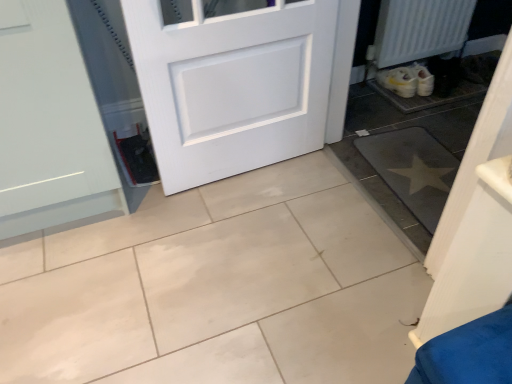
Where is `white textured radiator at lower right`? Image resolution: width=512 pixels, height=384 pixels. white textured radiator at lower right is located at coordinates (420, 29).

Is gray matte mat at lower right, marked as the 2th ceramic tile in a left-to-right arrangement, facing away from white textured radiator at lower right?

No.

Considering the positions of objects gray matte mat at lower right, marked as the 2th ceramic tile in a left-to-right arrangement, and white textured radiator at lower right in the image provided, who is behind, gray matte mat at lower right, marked as the 2th ceramic tile in a left-to-right arrangement, or white textured radiator at lower right?

white textured radiator at lower right is behind.

Does point (434, 138) appear closer or farther from the camera than point (418, 20)?

Point (434, 138) appears to be closer to the viewer than point (418, 20).

From the image's perspective, which one is positioned higher, gray matte mat at lower right, marked as the 2th ceramic tile in a left-to-right arrangement, or white textured radiator at lower right?

white textured radiator at lower right.

Considering the relative sizes of white glossy tile at center, acting as the first ceramic tile starting from the left, and white textured radiator at lower right in the image provided, is white glossy tile at center, acting as the first ceramic tile starting from the left, shorter than white textured radiator at lower right?

Indeed, white glossy tile at center, acting as the first ceramic tile starting from the left, has a lesser height compared to white textured radiator at lower right.

Is white glossy tile at center, which is the second ceramic tile from right to left, beside white textured radiator at lower right?

No, white glossy tile at center, which is the second ceramic tile from right to left, is not next to white textured radiator at lower right.

Between point (287, 179) and point (438, 29), which one is positioned behind?

The point (438, 29) is farther.

From a real-world perspective, does white glossy tile at center, which is the second ceramic tile from right to left, sit lower than white textured radiator at lower right?

Yes, from a real-world perspective, white glossy tile at center, which is the second ceramic tile from right to left, is beneath white textured radiator at lower right.

Considering the relative sizes of white textured radiator at lower right and gray matte mat at lower right, marked as the 2th ceramic tile in a left-to-right arrangement, in the image provided, is white textured radiator at lower right smaller than gray matte mat at lower right, marked as the 2th ceramic tile in a left-to-right arrangement,?

Actually, white textured radiator at lower right might be larger than gray matte mat at lower right, marked as the 2th ceramic tile in a left-to-right arrangement.

Is white textured radiator at lower right turned away from gray matte mat at lower right, marked as the 1th ceramic tile in a right-to-left arrangement?

white textured radiator at lower right is not turned away from gray matte mat at lower right, marked as the 1th ceramic tile in a right-to-left arrangement.

From the image's perspective, is white textured radiator at lower right beneath gray matte mat at lower right, marked as the 2th ceramic tile in a left-to-right arrangement?

Incorrect, from the image's perspective, white textured radiator at lower right is higher than gray matte mat at lower right, marked as the 2th ceramic tile in a left-to-right arrangement.

Considering the relative sizes of white glossy tile at center, acting as the first ceramic tile starting from the left, and gray matte mat at lower right, marked as the 1th ceramic tile in a right-to-left arrangement, in the image provided, is white glossy tile at center, acting as the first ceramic tile starting from the left, thinner than gray matte mat at lower right, marked as the 1th ceramic tile in a right-to-left arrangement,?

No, white glossy tile at center, acting as the first ceramic tile starting from the left, is not thinner than gray matte mat at lower right, marked as the 1th ceramic tile in a right-to-left arrangement.

Is white glossy tile at center, which is the second ceramic tile from right to left, looking in the opposite direction of gray matte mat at lower right, marked as the 1th ceramic tile in a right-to-left arrangement?

No, white glossy tile at center, which is the second ceramic tile from right to left, is not facing away from gray matte mat at lower right, marked as the 1th ceramic tile in a right-to-left arrangement.

From the image's perspective, is white glossy tile at center, which is the second ceramic tile from right to left, above or below gray matte mat at lower right, marked as the 1th ceramic tile in a right-to-left arrangement?

white glossy tile at center, which is the second ceramic tile from right to left, is situated lower than gray matte mat at lower right, marked as the 1th ceramic tile in a right-to-left arrangement, in the image.

Which object is wider, gray matte mat at lower right, marked as the 1th ceramic tile in a right-to-left arrangement, or white matte door at center?

Wider between the two is gray matte mat at lower right, marked as the 1th ceramic tile in a right-to-left arrangement.

Is gray matte mat at lower right, marked as the 1th ceramic tile in a right-to-left arrangement, positioned beyond the bounds of white matte door at center?

Absolutely, gray matte mat at lower right, marked as the 1th ceramic tile in a right-to-left arrangement, is external to white matte door at center.

Can you see gray matte mat at lower right, marked as the 1th ceramic tile in a right-to-left arrangement, touching white matte door at center?

gray matte mat at lower right, marked as the 1th ceramic tile in a right-to-left arrangement, and white matte door at center are clearly separated.

From the image's perspective, which one is positioned higher, white glossy tile at center, acting as the first ceramic tile starting from the left, or white matte door at center?

white matte door at center is shown above in the image.

From a real-world perspective, is white glossy tile at center, which is the second ceramic tile from right to left, above or below white matte door at center?

In terms of real-world spatial position, white glossy tile at center, which is the second ceramic tile from right to left, is below white matte door at center.

Is white glossy tile at center, which is the second ceramic tile from right to left, at the left side of white matte door at center?

Correct, you'll find white glossy tile at center, which is the second ceramic tile from right to left, to the left of white matte door at center.

In the scene shown: Does white glossy tile at center, which is the second ceramic tile from right to left, turn towards white matte door at center?

No.

Which object is more forward, white textured radiator at lower right or white glossy tile at center, acting as the first ceramic tile starting from the left?

Positioned in front is white glossy tile at center, acting as the first ceramic tile starting from the left.

Does white textured radiator at lower right appear on the left side of white glossy tile at center, acting as the first ceramic tile starting from the left?

In fact, white textured radiator at lower right is to the right of white glossy tile at center, acting as the first ceramic tile starting from the left.

From a real-world perspective, who is located lower, white textured radiator at lower right or white glossy tile at center, acting as the first ceramic tile starting from the left?

white glossy tile at center, acting as the first ceramic tile starting from the left, is physically lower.

Based on the photo, what's the angular difference between white textured radiator at lower right and white glossy tile at center, acting as the first ceramic tile starting from the left,'s facing directions?

They differ by 179 degrees in their facing directions.

Find the location of `radiator that appears on the right of gray matte mat at lower right, marked as the 2th ceramic tile in a left-to-right arrangement`. radiator that appears on the right of gray matte mat at lower right, marked as the 2th ceramic tile in a left-to-right arrangement is located at coordinates (420, 29).

From a real-world perspective, starting from the white textured radiator at lower right, which ceramic tile is the 2nd one below it? Please provide its 2D coordinates.

[(217, 289)]

Estimate the real-world distances between objects in this image. Which object is further from white glossy tile at center, which is the second ceramic tile from right to left, gray matte mat at lower right, marked as the 1th ceramic tile in a right-to-left arrangement, or white matte door at center?

The object further to white glossy tile at center, which is the second ceramic tile from right to left, is gray matte mat at lower right, marked as the 1th ceramic tile in a right-to-left arrangement.

Based on their spatial positions, is white matte door at center or white textured radiator at lower right closer to gray matte mat at lower right, marked as the 2th ceramic tile in a left-to-right arrangement?

white matte door at center is positioned closer to the anchor gray matte mat at lower right, marked as the 2th ceramic tile in a left-to-right arrangement.

When comparing their distances from white glossy tile at center, acting as the first ceramic tile starting from the left, does white matte door at center or gray matte mat at lower right, marked as the 2th ceramic tile in a left-to-right arrangement, seem further?

gray matte mat at lower right, marked as the 2th ceramic tile in a left-to-right arrangement, lies further to white glossy tile at center, acting as the first ceramic tile starting from the left, than the other object.

Looking at the image, which one is located further to white matte door at center, white glossy tile at center, which is the second ceramic tile from right to left, or white textured radiator at lower right?

Based on the image, white textured radiator at lower right appears to be further to white matte door at center.

Based on their spatial positions, is white glossy tile at center, which is the second ceramic tile from right to left, or gray matte mat at lower right, marked as the 1th ceramic tile in a right-to-left arrangement, closer to white matte door at center?

white glossy tile at center, which is the second ceramic tile from right to left, lies closer to white matte door at center than the other object.

Looking at the image, which one is located closer to white textured radiator at lower right, white matte door at center or gray matte mat at lower right, marked as the 1th ceramic tile in a right-to-left arrangement?

gray matte mat at lower right, marked as the 1th ceramic tile in a right-to-left arrangement, is closer to white textured radiator at lower right.

Based on the photo, considering their positions, is white glossy tile at center, which is the second ceramic tile from right to left, positioned closer to gray matte mat at lower right, marked as the 1th ceramic tile in a right-to-left arrangement, than white textured radiator at lower right?

white glossy tile at center, which is the second ceramic tile from right to left, lies closer to gray matte mat at lower right, marked as the 1th ceramic tile in a right-to-left arrangement, than the other object.

When comparing their distances from gray matte mat at lower right, marked as the 2th ceramic tile in a left-to-right arrangement, does white glossy tile at center, which is the second ceramic tile from right to left, or white matte door at center seem closer?

white matte door at center is positioned closer to the anchor gray matte mat at lower right, marked as the 2th ceramic tile in a left-to-right arrangement.

Image resolution: width=512 pixels, height=384 pixels. What are the coordinates of `ceramic tile between white matte door at center and white textured radiator at lower right from left to right` in the screenshot? It's located at (413, 170).

This screenshot has height=384, width=512. I want to click on ceramic tile located between white glossy tile at center, which is the second ceramic tile from right to left, and white textured radiator at lower right in the depth direction, so click(413, 170).

This screenshot has height=384, width=512. What are the coordinates of `door between white glossy tile at center, acting as the first ceramic tile starting from the left, and white textured radiator at lower right from front to back` in the screenshot? It's located at (232, 86).

Where is `door between white glossy tile at center, which is the second ceramic tile from right to left, and gray matte mat at lower right, marked as the 1th ceramic tile in a right-to-left arrangement, in the horizontal direction`? door between white glossy tile at center, which is the second ceramic tile from right to left, and gray matte mat at lower right, marked as the 1th ceramic tile in a right-to-left arrangement, in the horizontal direction is located at coordinates (232, 86).